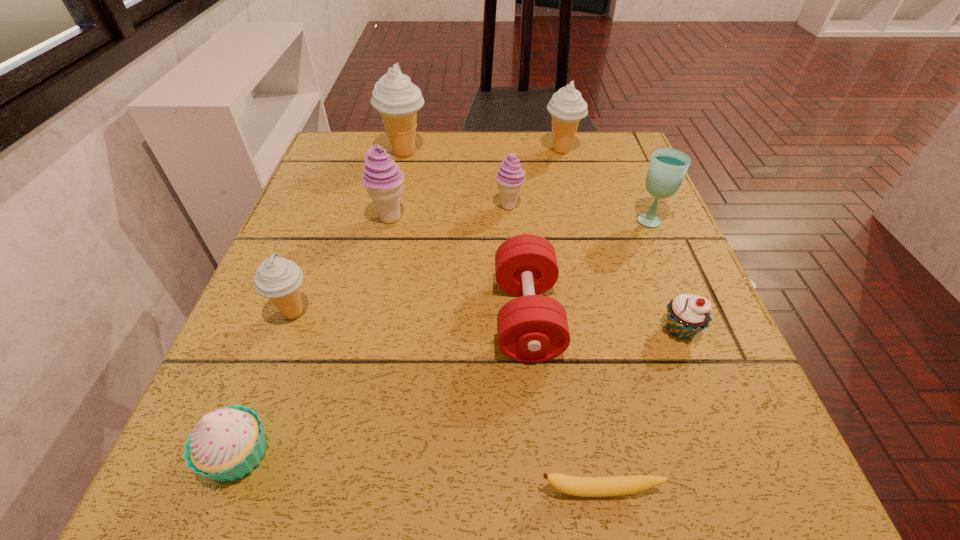
This screenshot has width=960, height=540. I want to click on cupcake located at the right edge, so click(687, 315).

This screenshot has height=540, width=960. What are the coordinates of `object positioned at the far left corner` in the screenshot? It's located at (395, 97).

You are a GUI agent. You are given a task and a screenshot of the screen. Output one action in this format:
    pyautogui.click(x=<x>, y=<y>)
    Task: Click on the object that is at the near left corner
    This screenshot has width=960, height=540.
    Given the screenshot: What is the action you would take?
    pyautogui.click(x=226, y=444)

Locate an element on the screen. The width and height of the screenshot is (960, 540). object positioned at the far right corner is located at coordinates (567, 107).

Identify the location of vacant area at the far edge. (526, 166).

Identify the location of vacant position at the near edge of the desktop. (643, 441).

Find the location of `vacant space at the left edge`. vacant space at the left edge is located at coordinates (198, 412).

This screenshot has height=540, width=960. Find the location of `vacant space at the right edge of the desktop`. vacant space at the right edge of the desktop is located at coordinates (663, 205).

The image size is (960, 540). What are the coordinates of `vacant space at the near right corner of the desktop` in the screenshot? It's located at (x=685, y=496).

This screenshot has height=540, width=960. What are the coordinates of `blank region between the glass and the bigger purple icecream` in the screenshot? It's located at (520, 219).